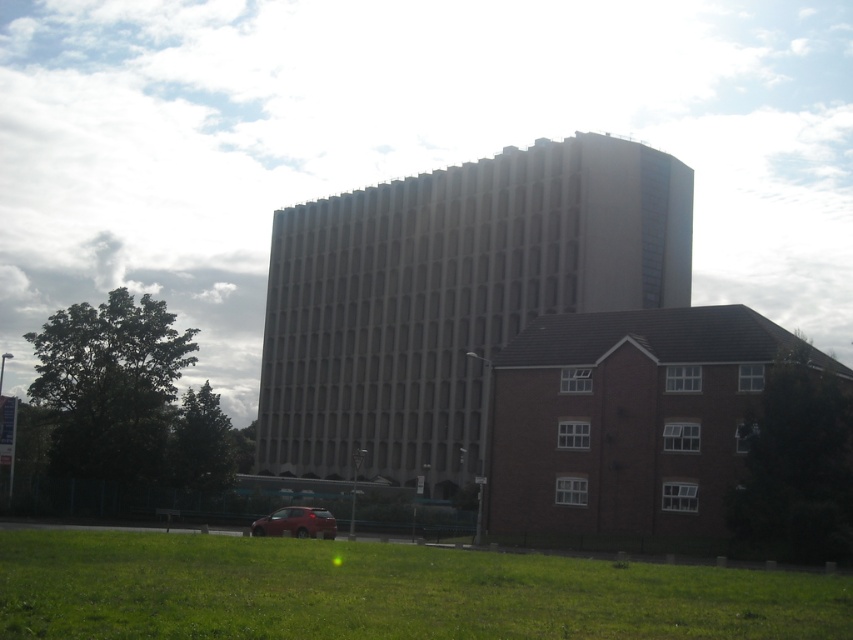
Which of these two, green grass at lower center or metallic red hatchback at lower center, stands shorter?

Standing shorter between the two is metallic red hatchback at lower center.

Which is in front, point (343, 572) or point (265, 516)?

Point (343, 572) is more forward.

Locate an element on the screen. This screenshot has width=853, height=640. green grass at lower center is located at coordinates (384, 593).

Measure the distance between beige concrete building at center and camera.

beige concrete building at center is 276.21 feet away from camera.

Does beige concrete building at center appear on the right side of metallic red hatchback at lower center?

Correct, you'll find beige concrete building at center to the right of metallic red hatchback at lower center.

This screenshot has height=640, width=853. In order to click on beige concrete building at center in this screenshot , I will do `click(451, 296)`.

Is beige concrete building at center taller than green grass at lower center?

Correct, beige concrete building at center is much taller as green grass at lower center.

Who is more forward, (535, 172) or (164, 563)?

Positioned in front is point (164, 563).

Find the location of a particular element. Image resolution: width=853 pixels, height=640 pixels. beige concrete building at center is located at coordinates (451, 296).

Where is `beige concrete building at center`? beige concrete building at center is located at coordinates (451, 296).